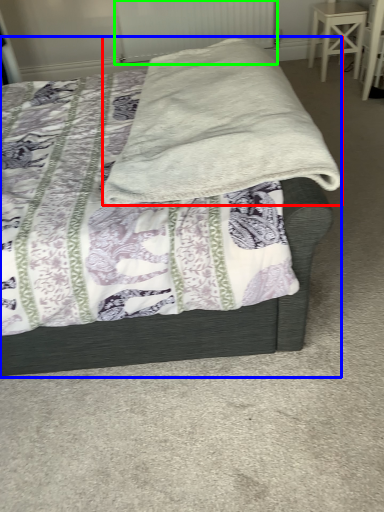
Question: Which is farther away from blanket (highlighted by a red box)? bed (highlighted by a blue box) or radiator (highlighted by a green box)?

Choices:
 (A) bed
 (B) radiator

Answer: (B)